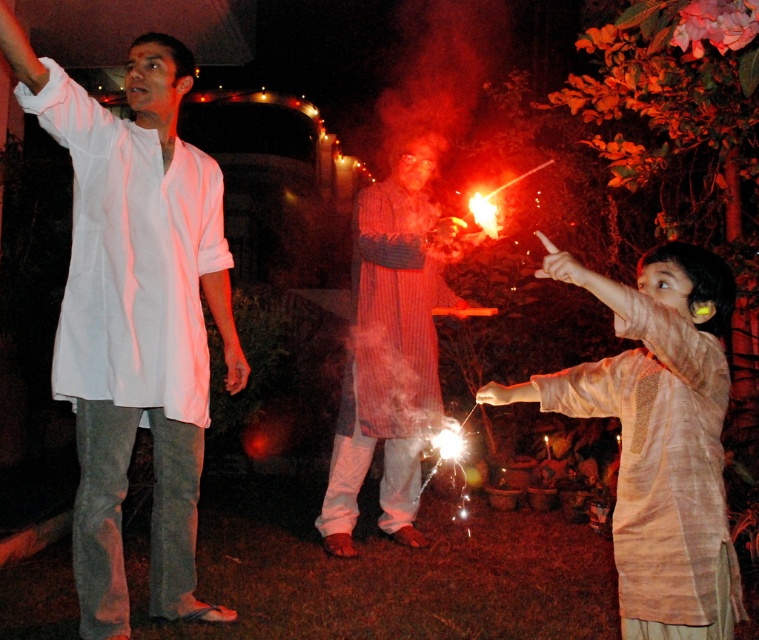
Is white cotton shirt at upper left taller than matte beige kurta at right?

Indeed, white cotton shirt at upper left has a greater height compared to matte beige kurta at right.

In the scene shown: Does white cotton shirt at upper left have a lesser width compared to matte beige kurta at right?

Indeed, white cotton shirt at upper left has a lesser width compared to matte beige kurta at right.

Find the location of a particular element. This screenshot has height=640, width=759. white cotton shirt at upper left is located at coordinates (134, 316).

In order to click on white cotton shirt at upper left in this screenshot , I will do `click(134, 316)`.

Which is in front, point (90, 513) or point (358, 264)?

Point (90, 513)

Is white cotton shirt at upper left positioned before striped cotton robe at center?

Yes, it is.

Is point (159, 586) positioned behind point (433, 250)?

That is False.

Where is `white cotton shirt at upper left`? The height and width of the screenshot is (640, 759). white cotton shirt at upper left is located at coordinates click(134, 316).

Is matte beige kurta at right smaller than striped cotton robe at center?

Correct, matte beige kurta at right occupies less space than striped cotton robe at center.

Find the location of a particular element. Image resolution: width=759 pixels, height=640 pixels. matte beige kurta at right is located at coordinates (657, 435).

Is point (704, 397) farther from viewer compared to point (420, 429)?

No.

The image size is (759, 640). I want to click on matte beige kurta at right, so click(x=657, y=435).